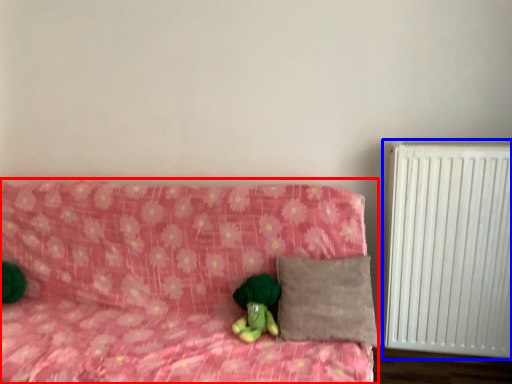
Question: Which object is closer to the camera taking this photo, furniture (highlighted by a red box) or radiator (highlighted by a blue box)?

Choices:
 (A) furniture
 (B) radiator

Answer: (A)